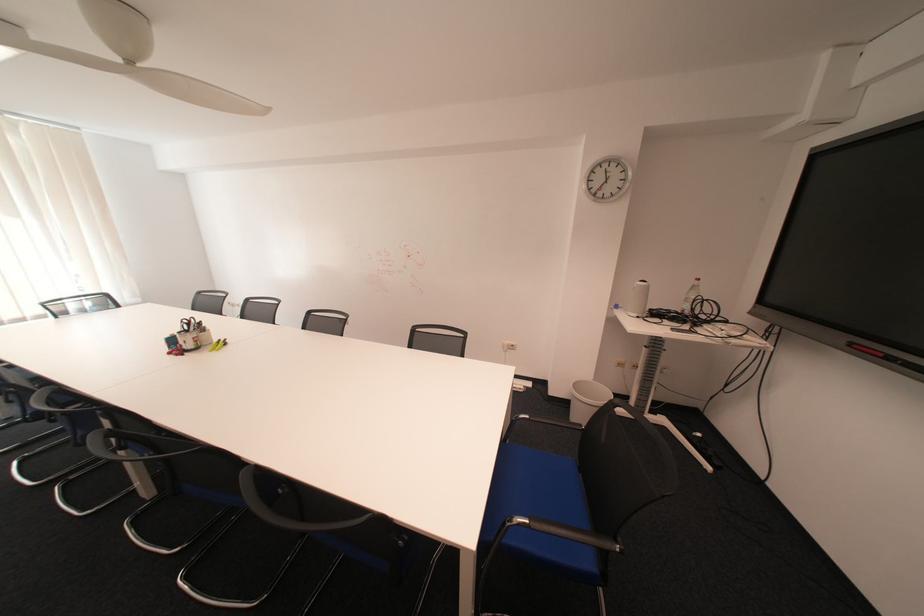
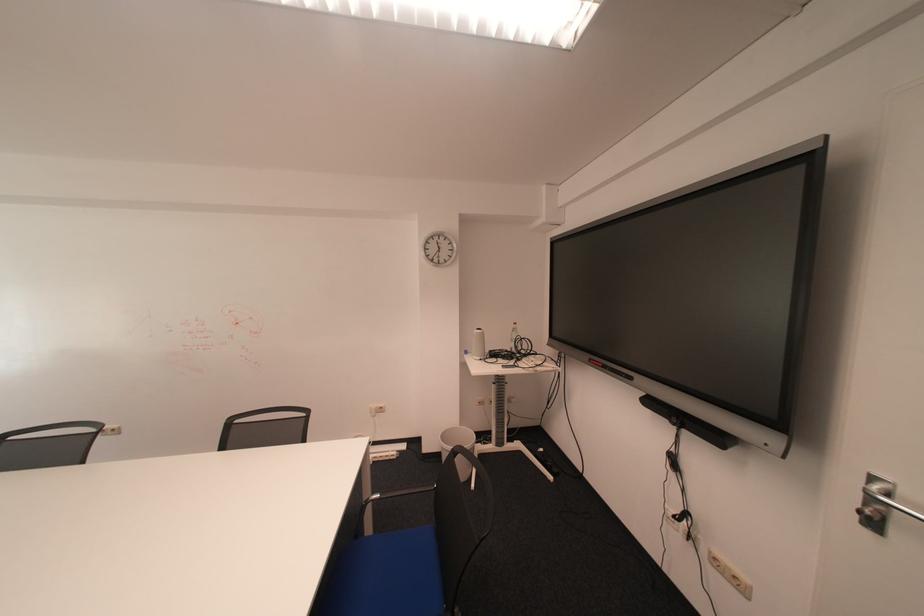
Locate, in the second image, the point that corresponds to (515,344) in the first image.

(382, 408)